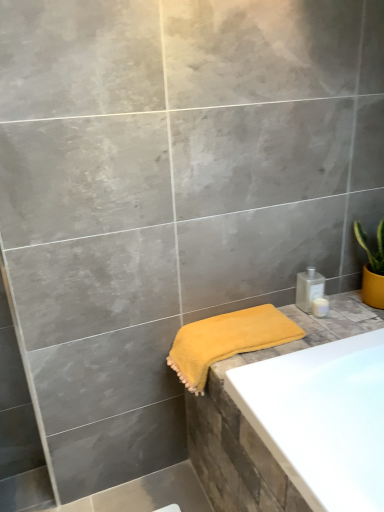
In order to click on free spot above yellow soft towel at lower right (from a real-world perspective) in this screenshot , I will do 212,327.